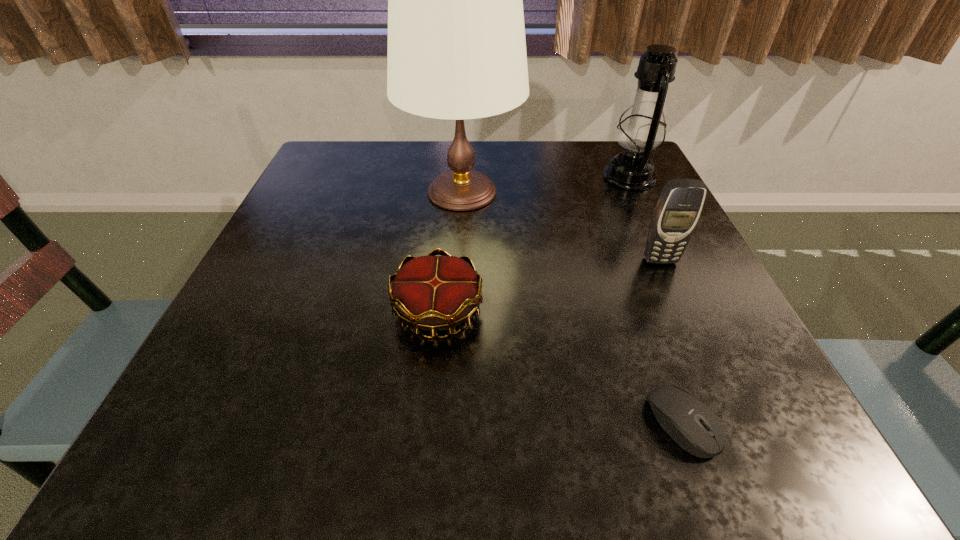
Where is `free space that satisfies the following two spatial constraints: 1. on the back side of the computer equipment; 2. on the left side of the second tallest object`? The width and height of the screenshot is (960, 540). free space that satisfies the following two spatial constraints: 1. on the back side of the computer equipment; 2. on the left side of the second tallest object is located at coordinates (593, 177).

Image resolution: width=960 pixels, height=540 pixels. What are the coordinates of `free point that satisfies the following two spatial constraints: 1. on the front side of the nearest object; 2. on the right side of the lamp` in the screenshot? It's located at (449, 422).